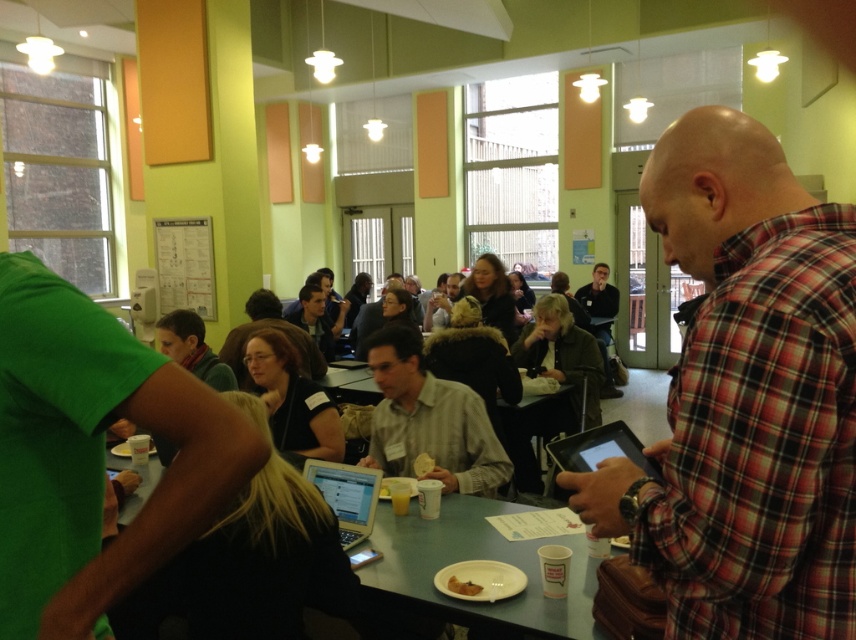
You are standing in the room and see the point marked at coordinates (93, 454). What object or feature is located at that point?

The point at coordinates (93, 454) marks the green fabric shirt at left.